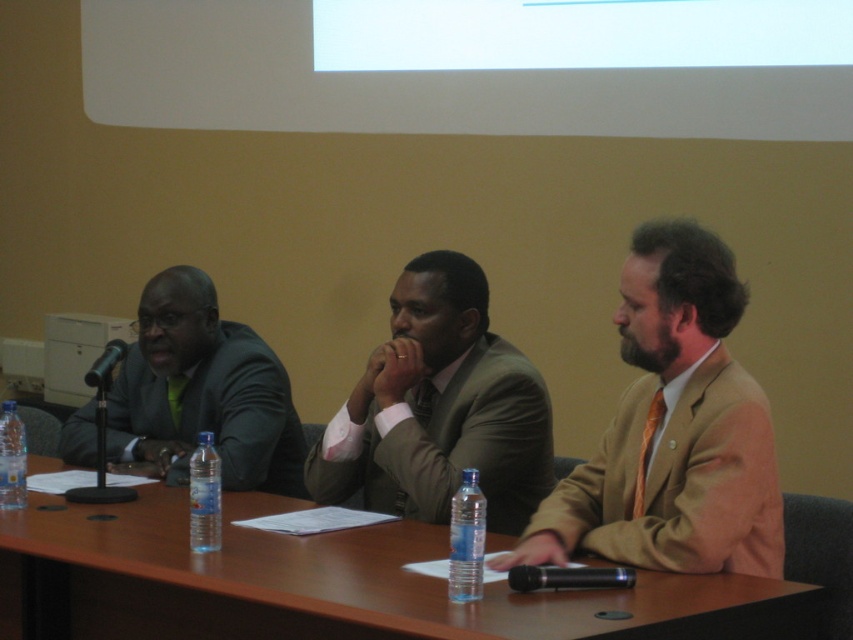
Which of these two, matte brown suit at center or transparent plastic water bottle at center, stands taller?

With more height is matte brown suit at center.

Is matte brown suit at center to the left of transparent plastic water bottle at center from the viewer's perspective?

In fact, matte brown suit at center is to the right of transparent plastic water bottle at center.

This screenshot has width=853, height=640. Describe the element at coordinates (672, 429) in the screenshot. I see `matte brown suit at center` at that location.

Where is `matte brown suit at center`? matte brown suit at center is located at coordinates (672, 429).

Between matte brown suit at center and clear plastic bottle at table center, which one has more height?

matte brown suit at center

Is matte brown suit at center above clear plastic bottle at table center?

Correct, matte brown suit at center is located above clear plastic bottle at table center.

Measure the distance between matte brown suit at center and camera.

matte brown suit at center is 2.02 meters from camera.

In order to click on matte brown suit at center in this screenshot , I will do click(x=672, y=429).

Can you confirm if brown wooden table at center is smaller than matte green suit at center?

No.

Who is shorter, brown wooden table at center or matte green suit at center?

Standing shorter between the two is brown wooden table at center.

Is point (740, 579) less distant than point (503, 417)?

Yes, point (740, 579) is closer to viewer.

This screenshot has width=853, height=640. Find the location of `brown wooden table at center`. brown wooden table at center is located at coordinates (329, 584).